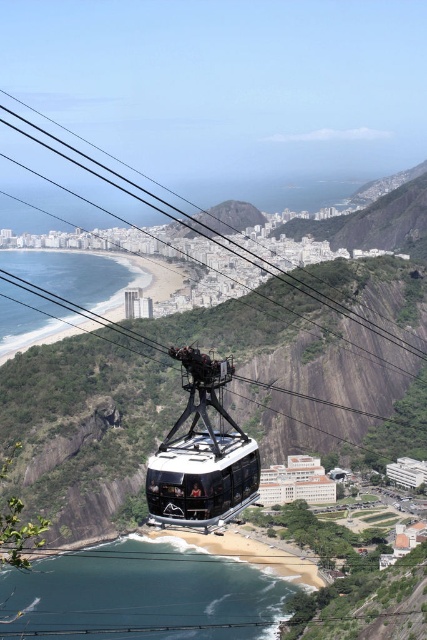
Question: Which point is closer to the camera?

Choices:
 (A) (228, 513)
 (B) (187, 232)

Answer: (A)

Question: Does shiny black cable car at center lie behind green rock at center?

Choices:
 (A) no
 (B) yes

Answer: (A)

Question: In this image, where is shiny black cable car at center located relative to green rock at center?

Choices:
 (A) below
 (B) above

Answer: (A)

Question: Does shiny black cable car at center have a greater width compared to green rock at center?

Choices:
 (A) no
 (B) yes

Answer: (A)